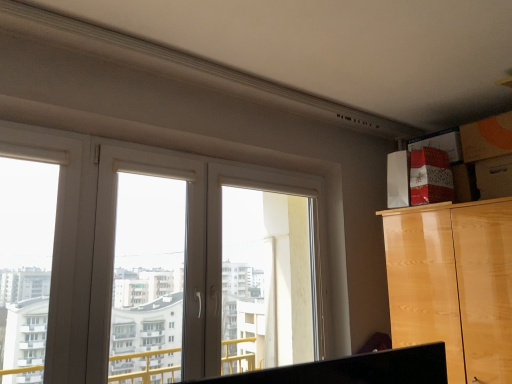
What is the approximate width of white plastic window frame at center, which ranks as the 1th window frame in right-to-left order?

white plastic window frame at center, which ranks as the 1th window frame in right-to-left order, is 20.66 centimeters in width.

How much space does white plastic window frame at center, the 2th window frame positioned from the left, occupy vertically?

3.48 feet.

In the scene shown: Measure the distance between glossy wood cabinet at upper right and camera.

glossy wood cabinet at upper right and camera are 1.83 meters apart.

Locate an element on the screen. white plastic window frame at center, the 2th window frame positioned from the left is located at coordinates (263, 267).

How far apart are glossy wood cabinet at upper right and wooden drawer at upper right?

glossy wood cabinet at upper right is 19.18 inches from wooden drawer at upper right.

From the image's perspective, is glossy wood cabinet at upper right located above or below wooden drawer at upper right?

Clearly, from the image's perspective, glossy wood cabinet at upper right is below wooden drawer at upper right.

Is glossy wood cabinet at upper right at the right side of wooden drawer at upper right?

No.

Which of these two, glossy wood cabinet at upper right or wooden drawer at upper right, is wider?

Wider between the two is glossy wood cabinet at upper right.

This screenshot has height=384, width=512. Find the location of `cabinetry located in front of the white plastic window frame at center, which ranks as the 1th window frame in right-to-left order`. cabinetry located in front of the white plastic window frame at center, which ranks as the 1th window frame in right-to-left order is located at coordinates point(453,284).

From a real-world perspective, is white plastic window frame at center, which ranks as the 1th window frame in right-to-left order, positioned above or below glossy wood cabinet at upper right?

white plastic window frame at center, which ranks as the 1th window frame in right-to-left order, is situated higher than glossy wood cabinet at upper right in the real world.

Considering the sizes of objects white plastic window frame at center, the 2th window frame positioned from the left, and glossy wood cabinet at upper right in the image provided, who is wider, white plastic window frame at center, the 2th window frame positioned from the left, or glossy wood cabinet at upper right?

glossy wood cabinet at upper right is wider.

From a real-world perspective, between wooden drawer at upper right and white plastic window frame at center, which ranks as the 1th window frame in right-to-left order, who is vertically lower?

white plastic window frame at center, which ranks as the 1th window frame in right-to-left order, is physically lower.

Can you see wooden drawer at upper right touching white plastic window frame at center, which ranks as the 1th window frame in right-to-left order?

They are not placed beside each other.

Is wooden drawer at upper right smaller than white plastic window frame at center, which ranks as the 1th window frame in right-to-left order?

Correct, wooden drawer at upper right occupies less space than white plastic window frame at center, which ranks as the 1th window frame in right-to-left order.

Considering their positions, is wooden drawer at upper right located in front of or behind white plastic window frame at center, the 2th window frame positioned from the left?

Clearly, wooden drawer at upper right is behind white plastic window frame at center, the 2th window frame positioned from the left.

Considering the sizes of objects wooden drawer at upper right and glossy wood cabinet at upper right in the image provided, who is shorter, wooden drawer at upper right or glossy wood cabinet at upper right?

With less height is wooden drawer at upper right.

From the image's perspective, which is above, wooden drawer at upper right or glossy wood cabinet at upper right?

wooden drawer at upper right, from the image's perspective.

Considering the positions of objects wooden drawer at upper right and glossy wood cabinet at upper right in the image provided, who is more to the left, wooden drawer at upper right or glossy wood cabinet at upper right?

glossy wood cabinet at upper right is more to the left.

From the image's perspective, is white plastic window frame at center, the 2th window frame positioned from the left, over wooden drawer at upper right?

No, from the image's perspective, white plastic window frame at center, the 2th window frame positioned from the left, is not over wooden drawer at upper right.

What's the angular difference between white plastic window frame at center, the 2th window frame positioned from the left, and wooden drawer at upper right's facing directions?

The angle between the facing direction of white plastic window frame at center, the 2th window frame positioned from the left, and the facing direction of wooden drawer at upper right is 90.8 degrees.

Considering the relative sizes of white plastic window frame at center, the 2th window frame positioned from the left, and wooden drawer at upper right in the image provided, is white plastic window frame at center, the 2th window frame positioned from the left, shorter than wooden drawer at upper right?

Incorrect, the height of white plastic window frame at center, the 2th window frame positioned from the left, does not fall short of that of wooden drawer at upper right.

From the image's perspective, starting from the wooden drawer at upper right, which window frame is the 2nd one below? Please provide its 2D coordinates.

[(263, 267)]

Is point (167, 194) more distant than point (458, 324)?

Yes, point (167, 194) is behind point (458, 324).

From a real-world perspective, starting from the glossy wood cabinet at upper right, which window frame is the 1st one vertically above it? Please provide its 2D coordinates.

[(148, 260)]

Can you confirm if white plastic window at center, acting as the first window frame starting from the left, is taller than glossy wood cabinet at upper right?

Correct, white plastic window at center, acting as the first window frame starting from the left, is much taller as glossy wood cabinet at upper right.

Considering the sizes of objects glossy wood cabinet at upper right and white plastic window frame at center, which ranks as the 1th window frame in right-to-left order, in the image provided, who is smaller, glossy wood cabinet at upper right or white plastic window frame at center, which ranks as the 1th window frame in right-to-left order,?

Smaller between the two is white plastic window frame at center, which ranks as the 1th window frame in right-to-left order.

Considering the positions of objects glossy wood cabinet at upper right and white plastic window frame at center, which ranks as the 1th window frame in right-to-left order, in the image provided, who is more to the right, glossy wood cabinet at upper right or white plastic window frame at center, which ranks as the 1th window frame in right-to-left order,?

Positioned to the right is glossy wood cabinet at upper right.

Is glossy wood cabinet at upper right completely or partially outside of white plastic window frame at center, which ranks as the 1th window frame in right-to-left order?

That's correct, glossy wood cabinet at upper right is outside of white plastic window frame at center, which ranks as the 1th window frame in right-to-left order.

Locate an element on the screen. cabinetry below the wooden drawer at upper right (from a real-world perspective) is located at coordinates (453, 284).

The height and width of the screenshot is (384, 512). Find the location of `the 1st window frame to the left when counting from the glossy wood cabinet at upper right`. the 1st window frame to the left when counting from the glossy wood cabinet at upper right is located at coordinates (263, 267).

When comparing their distances from wooden drawer at upper right, does white plastic window at center, which is the 2th window frame from right to left, or glossy wood cabinet at upper right seem closer?

Based on the image, glossy wood cabinet at upper right appears to be nearer to wooden drawer at upper right.

Consider the image. Which object lies nearer to the anchor point wooden drawer at upper right, glossy wood cabinet at upper right or white plastic window frame at center, which ranks as the 1th window frame in right-to-left order?

glossy wood cabinet at upper right is positioned closer to the anchor wooden drawer at upper right.

Based on their spatial positions, is white plastic window at center, acting as the first window frame starting from the left, or wooden drawer at upper right further from glossy wood cabinet at upper right?

white plastic window at center, acting as the first window frame starting from the left, is positioned further to the anchor glossy wood cabinet at upper right.

When comparing their distances from white plastic window at center, which is the 2th window frame from right to left, does glossy wood cabinet at upper right or wooden drawer at upper right seem further?

The object further to white plastic window at center, which is the 2th window frame from right to left, is wooden drawer at upper right.

From the picture: From the image, which object appears to be nearer to white plastic window frame at center, the 2th window frame positioned from the left, glossy wood cabinet at upper right or wooden drawer at upper right?

glossy wood cabinet at upper right is closer to white plastic window frame at center, the 2th window frame positioned from the left.

Based on their spatial positions, is white plastic window frame at center, the 2th window frame positioned from the left, or white plastic window at center, which is the 2th window frame from right to left, further from glossy wood cabinet at upper right?

white plastic window at center, which is the 2th window frame from right to left, is further to glossy wood cabinet at upper right.

Consider the image. Estimate the real-world distances between objects in this image. Which object is further from white plastic window at center, acting as the first window frame starting from the left, white plastic window frame at center, the 2th window frame positioned from the left, or glossy wood cabinet at upper right?

glossy wood cabinet at upper right.

From the image, which object appears to be nearer to wooden drawer at upper right, white plastic window frame at center, the 2th window frame positioned from the left, or white plastic window at center, acting as the first window frame starting from the left?

Result: white plastic window frame at center, the 2th window frame positioned from the left.

Locate an element on the screen. Image resolution: width=512 pixels, height=384 pixels. window frame situated between white plastic window at center, which is the 2th window frame from right to left, and wooden drawer at upper right from left to right is located at coordinates (263, 267).

You are a GUI agent. You are given a task and a screenshot of the screen. Output one action in this format:
    pyautogui.click(x=<x>, y=<y>)
    Task: Click on the cabinetry between white plastic window at center, which is the 2th window frame from right to left, and wooden drawer at upper right from left to right
    This screenshot has width=512, height=384.
    Given the screenshot: What is the action you would take?
    pyautogui.click(x=453, y=284)

Where is `window frame between white plastic window at center, which is the 2th window frame from right to left, and glossy wood cabinet at upper right, in the horizontal direction`? window frame between white plastic window at center, which is the 2th window frame from right to left, and glossy wood cabinet at upper right, in the horizontal direction is located at coordinates (263, 267).

Locate an element on the screen. This screenshot has height=384, width=512. cabinetry between white plastic window frame at center, the 2th window frame positioned from the left, and wooden drawer at upper right is located at coordinates [453, 284].